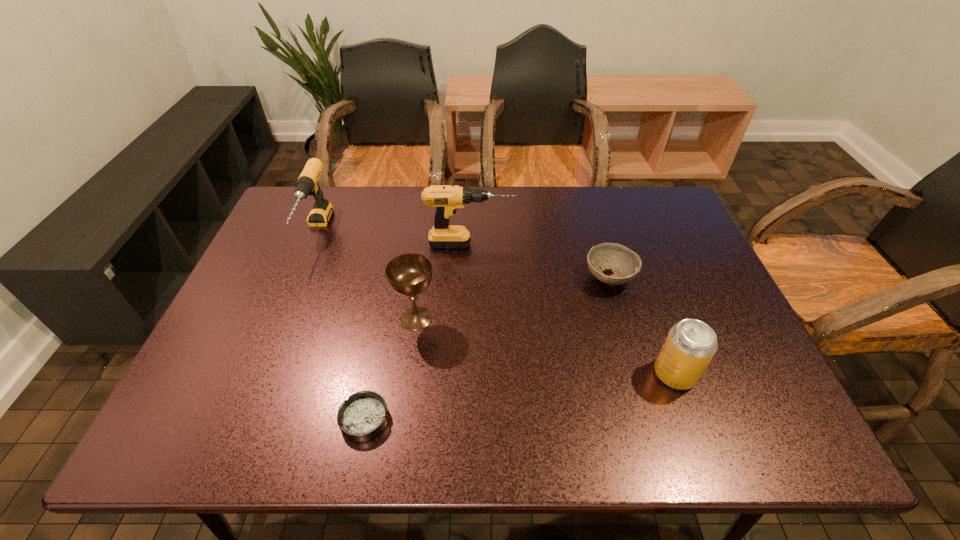
You are a GUI agent. You are given a task and a screenshot of the screen. Output one action in this format:
    pyautogui.click(x=<x>, y=<y>)
    Task: Click on the right drill
    Image resolution: width=960 pixels, height=540 pixels.
    Given the screenshot: What is the action you would take?
    pyautogui.click(x=447, y=198)

I want to click on the leftmost object, so click(x=307, y=184).

The height and width of the screenshot is (540, 960). Find the location of `the shorter drill`. the shorter drill is located at coordinates (307, 184).

Identify the location of chalice. This screenshot has width=960, height=540. (410, 274).

This screenshot has width=960, height=540. What are the coordinates of `the fourth tallest object` in the screenshot? It's located at (690, 345).

Image resolution: width=960 pixels, height=540 pixels. Find the location of `the fifth farthest object`. the fifth farthest object is located at coordinates (690, 345).

Where is `the fifth tallest object`? This screenshot has width=960, height=540. the fifth tallest object is located at coordinates 625,264.

In order to click on the nearest object in this screenshot , I will do `click(363, 416)`.

You are a GUI agent. You are given a task and a screenshot of the screen. Output one action in this format:
    pyautogui.click(x=<x>, y=<y>)
    Task: Click on the ashtray
    
    Given the screenshot: What is the action you would take?
    pyautogui.click(x=363, y=416)

Identify the location of free space located at the tip of the right drill. This screenshot has width=960, height=540. (587, 244).